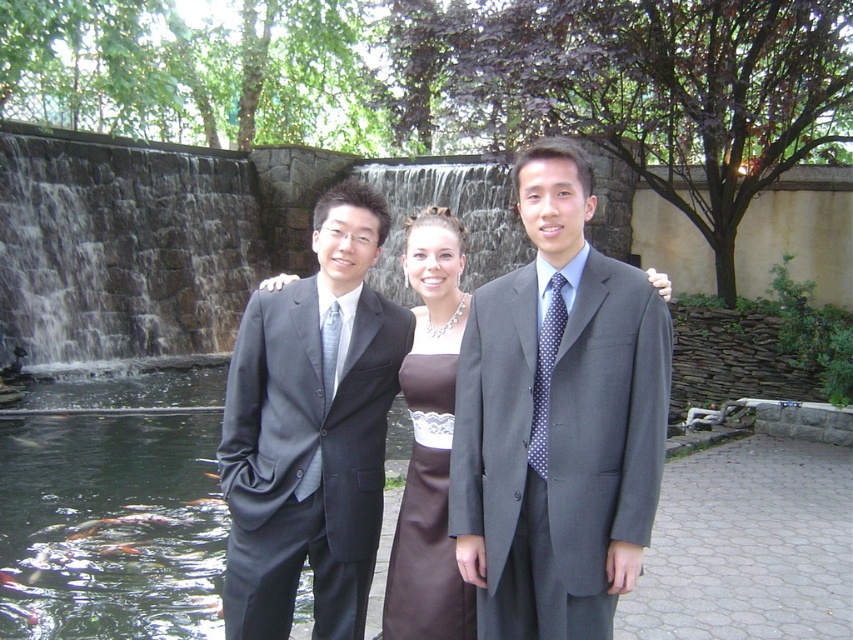
You are a photographer adjusting camera settings for a group photo. The subjects are wearing the matte gray suit at center and the brown satin dress at center. Which clothing item should you focus on first if you want to ensure proper exposure for the larger subject?

The matte gray suit at center has a larger size compared to the brown satin dress at center, so you should focus on the matte gray suit at center first to ensure proper exposure for the larger subject.

You are a photographer setting up for a group photo. You need to ensure that all subjects are visible in the frame. Given the scene described, which of the two central subjects, the matte black suit at center or the brown satin dress at center, requires more space to fully capture in the photograph?

The brown satin dress at center requires more space because it occupies more space than the matte black suit at center.

In the garden scene with the stone wall and waterfall, there is a matte gray suit at center and a shiny orange fish at center. Which object is positioned to the right of the other?

The matte gray suit at center is to the right of the shiny orange fish at center.